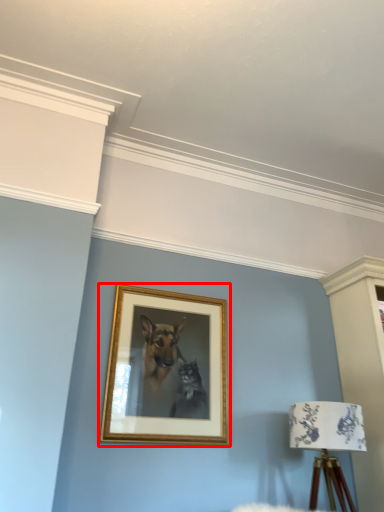
Question: From the image's perspective, considering the relative positions of picture frame (annotated by the red box) and table lamp in the image provided, where is picture frame (annotated by the red box) located with respect to the staircase?

Choices:
 (A) below
 (B) above

Answer: (B)